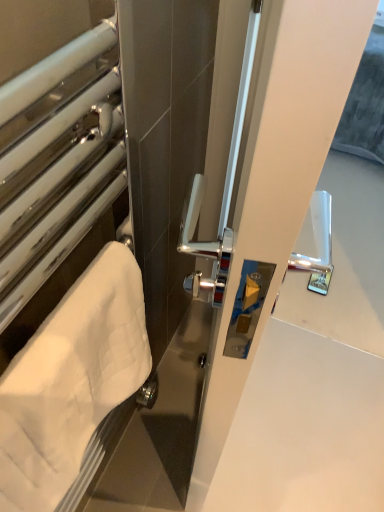
Question: From the image's perspective, is white towel at left above or below white quilted towel at left?

Choices:
 (A) below
 (B) above

Answer: (B)

Question: In terms of height, does white towel at left look taller or shorter compared to white quilted towel at left?

Choices:
 (A) short
 (B) tall

Answer: (B)

Question: Does point (31, 170) appear closer or farther from the camera than point (41, 390)?

Choices:
 (A) farther
 (B) closer

Answer: (A)

Question: From the image's perspective, is white quilted towel at left located above or below white towel at left?

Choices:
 (A) above
 (B) below

Answer: (B)

Question: Considering their positions, is white quilted towel at left located in front of or behind white towel at left?

Choices:
 (A) behind
 (B) front

Answer: (A)

Question: Considering the positions of point (125, 276) and point (105, 207), is point (125, 276) closer or farther from the camera than point (105, 207)?

Choices:
 (A) farther
 (B) closer

Answer: (B)

Question: Considering the positions of white quilted towel at left and white towel at left in the image, is white quilted towel at left taller or shorter than white towel at left?

Choices:
 (A) tall
 (B) short

Answer: (B)